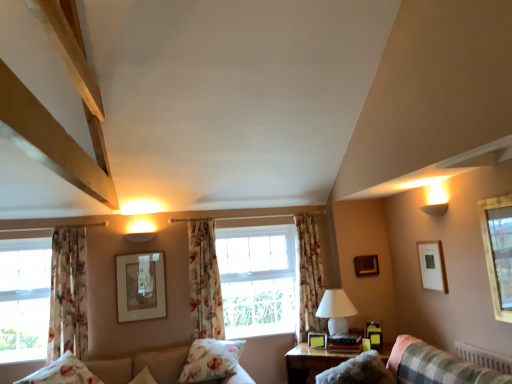
Question: In which direction should I rotate to look at floral fabric pillow at center, the 1th pillow from the right?

Choices:
 (A) right
 (B) left

Answer: (B)

Question: Can you confirm if matte gold picture frame at lower center, which is the 3th picture frame from front to back, is smaller than floral fabric pillow at center, the 1th pillow from the right?

Choices:
 (A) no
 (B) yes

Answer: (B)

Question: Can you confirm if matte gold picture frame at lower center, which is the 3th picture frame from front to back, is taller than floral fabric pillow at center, the 1th pillow from the right?

Choices:
 (A) no
 (B) yes

Answer: (A)

Question: Can you confirm if matte gold picture frame at lower center, which is the 3th picture frame from front to back, is positioned to the right of floral fabric pillow at center, the 2th pillow viewed from the left?

Choices:
 (A) yes
 (B) no

Answer: (A)

Question: From the image's perspective, is matte gold picture frame at lower center, marked as the fourth picture frame in a right-to-left arrangement, beneath floral fabric pillow at center, the 1th pillow from the right?

Choices:
 (A) yes
 (B) no

Answer: (B)

Question: From a real-world perspective, is matte gold picture frame at lower center, marked as the fourth picture frame in a right-to-left arrangement, positioned over floral fabric pillow at center, the 1th pillow from the right, based on gravity?

Choices:
 (A) yes
 (B) no

Answer: (B)

Question: Is matte gold picture frame at lower center, marked as the fourth picture frame in a right-to-left arrangement, positioned far away from floral fabric pillow at center, the 1th pillow from the right?

Choices:
 (A) no
 (B) yes

Answer: (B)

Question: Could you tell me if floral fabric curtain at left, the 3th curtain positioned from the right, is turned towards matte white picture frame at upper right, which ranks as the fifth picture frame in left-to-right order?

Choices:
 (A) no
 (B) yes

Answer: (A)

Question: Is floral fabric curtain at left, the 3th curtain positioned from the right, thinner than matte white picture frame at upper right, the first picture frame when ordered from front to back?

Choices:
 (A) yes
 (B) no

Answer: (B)

Question: Can you confirm if floral fabric curtain at left, the 3th curtain positioned from the right, is positioned to the right of matte white picture frame at upper right, which ranks as the fifth picture frame in left-to-right order?

Choices:
 (A) no
 (B) yes

Answer: (A)

Question: Considering the relative positions of floral fabric curtain at left, the 3th curtain positioned from the right, and matte white picture frame at upper right, which appears as the fifth picture frame when viewed from the back, in the image provided, is floral fabric curtain at left, the 3th curtain positioned from the right, behind matte white picture frame at upper right, which appears as the fifth picture frame when viewed from the back,?

Choices:
 (A) yes
 (B) no

Answer: (A)

Question: From a real-world perspective, does floral fabric curtain at left, the first curtain positioned from the left, stand above matte white picture frame at upper right, which ranks as the fifth picture frame in left-to-right order?

Choices:
 (A) yes
 (B) no

Answer: (B)

Question: From a real-world perspective, is floral fabric curtain at left, the first curtain positioned from the left, physically below matte white picture frame at upper right, which ranks as the fifth picture frame in left-to-right order?

Choices:
 (A) no
 (B) yes

Answer: (B)

Question: Considering the relative sizes of white glossy table lamp at center-right and clear glass window at upper right in the image provided, is white glossy table lamp at center-right smaller than clear glass window at upper right?

Choices:
 (A) no
 (B) yes

Answer: (A)